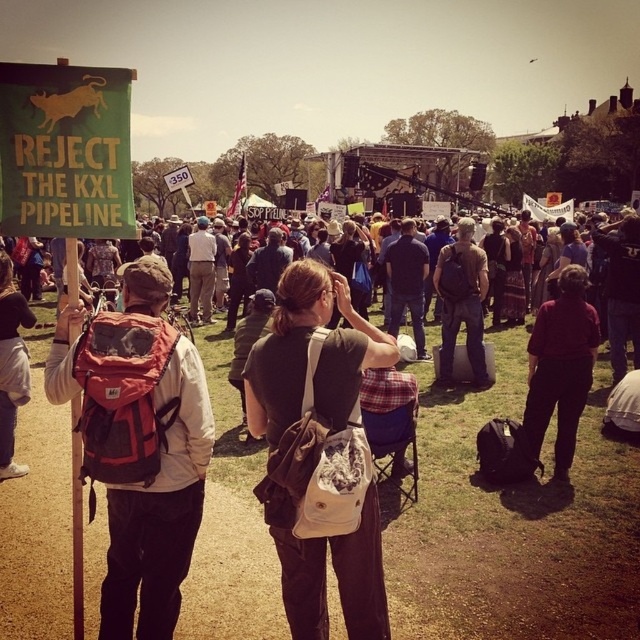
You are part of a protest group and need to identify two key participants. You see a dark red shirt at center and a brown backpack at center. Which participant is standing to the right of the other?

The dark red shirt at center is positioned on the right side of brown backpack at center, so the participant wearing the dark red shirt at center is standing to the right of the one with the brown backpack at center.

You are a photographer at the protest. You want to capture a photo of both the red backpack at left and the dark red shirt at center in the same frame. Your camera has a maximum focus range of 5 meters. Can you fit both subjects into the frame without moving closer?

The distance between the red backpack at left and the dark red shirt at center is 5.47 meters. Since your camera can only focus up to 5 meters, you cannot capture both subjects in the same frame without moving closer.